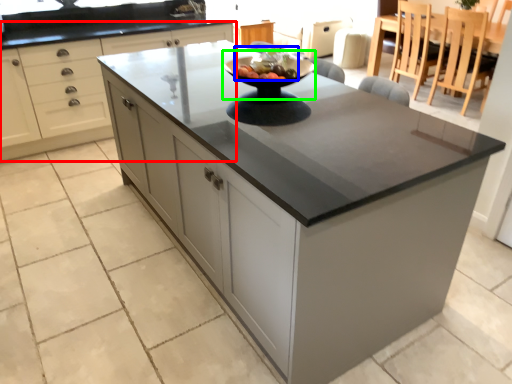
Question: Which object is the closest to the cabinetry (highlighted by a red box)? Choose among these: fruit salad (highlighted by a blue box) or mixing bowl (highlighted by a green box).

Choices:
 (A) fruit salad
 (B) mixing bowl

Answer: (B)